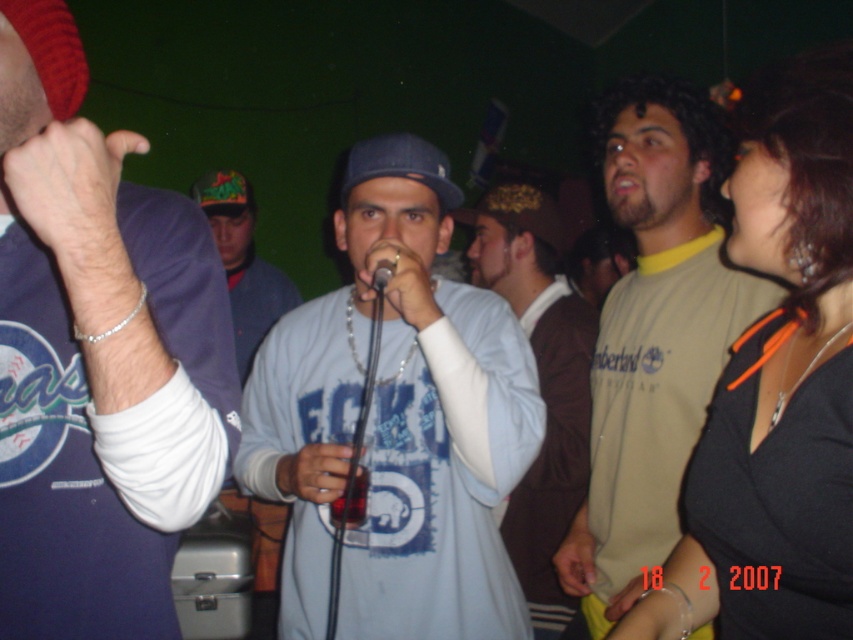
You are at a social gathering and see two items at the center of the scene. Which item is shorter in height between the matte blue sweatshirt at center and the brown leather jacket at center?

The matte blue sweatshirt at center is shorter in height than the brown leather jacket at center because the description states that the matte blue sweatshirt at center is not as tall as brown leather jacket at center.

You are at a social event and see a person wearing a light blue cotton shirt at center and holding a black metallic microphone at center. Which object is positioned to the right?

The black metallic microphone at center is to the right of the light blue cotton shirt at center.

You are at a social gathering and see a point at coordinates (396, 420). Which object is this point located on?

The point at coordinates (396, 420) is located on the light blue cotton shirt at center.